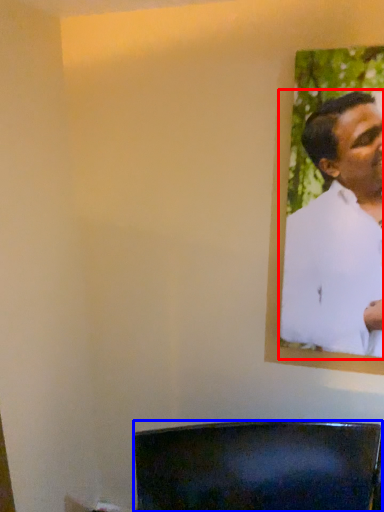
Question: Which object is further to the camera taking this photo, man (highlighted by a red box) or furniture (highlighted by a blue box)?

Choices:
 (A) man
 (B) furniture

Answer: (B)